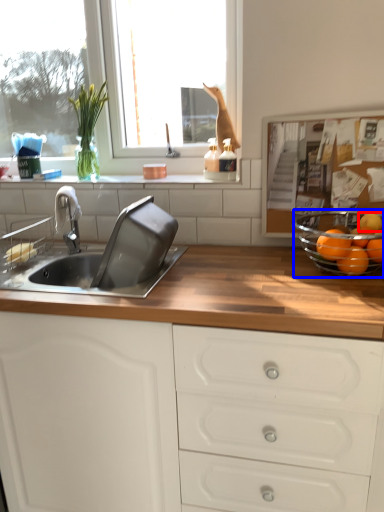
Question: Which of the following is the farthest to the observer, orange (highlighted by a red box) or glass bowl (highlighted by a blue box)?

Choices:
 (A) orange
 (B) glass bowl

Answer: (A)